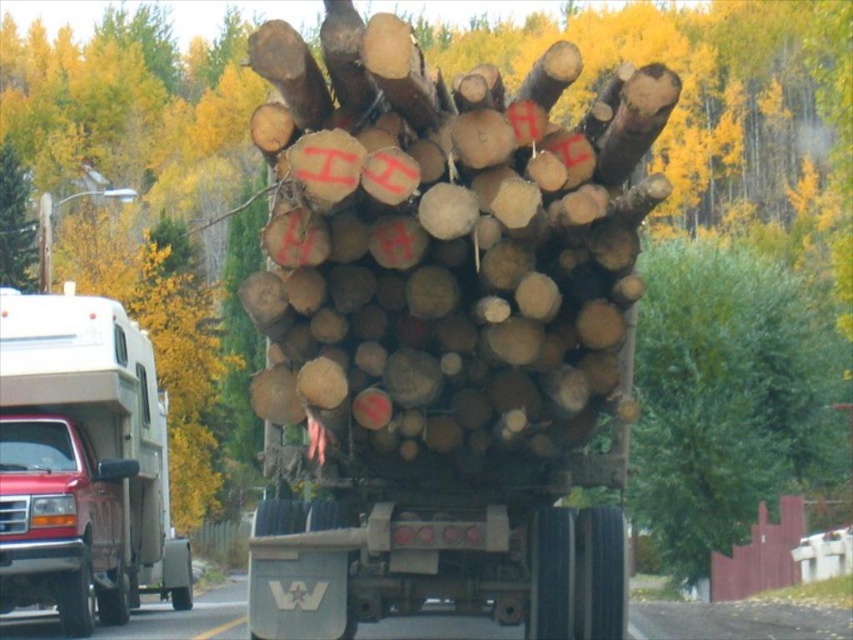
You are a delivery driver planning to transport the natural wood logs at center and the matte white truck at left through a narrow tunnel. The tunnel has a width limit of 2 meters. Knowing the logs are wider than the truck, can both items pass through the tunnel together?

The natural wood logs at center are wider than the matte white truck at left. Since the tunnel has a width limit of 2 meters, if the logs exceed this limit, they cannot pass. However, the truck might still fit. The question does not provide exact measurements, so it is unclear if both can pass together.

You are a delivery driver who needs to turn left onto a narrow road. You see the natural wood logs at center and the matte white truck at left in your view. Which object is closer to you, and would you have enough space to maneuver around it?

The natural wood logs at center are closer to you since they are in front of the matte white truck at left. Since the logs are in front, you would need to maneuver around them first. However, without knowing the exact dimensions of the logs and the road width, it is difficult to determine if there is enough space. Please check the road width and the size of the logs before proceeding.